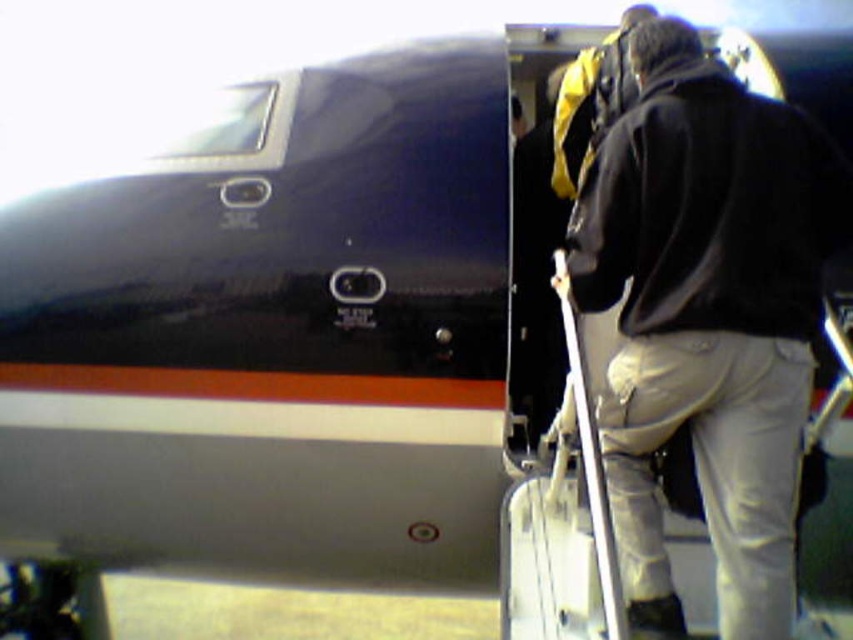
Does black leather jacket at center have a lesser height compared to white matte suitcase at center?

No, black leather jacket at center is not shorter than white matte suitcase at center.

Can you confirm if black leather jacket at center is positioned to the left of white matte suitcase at center?

In fact, black leather jacket at center is to the right of white matte suitcase at center.

Which is in front, point (659, 570) or point (587, 625)?

Positioned in front is point (659, 570).

Where is `black leather jacket at center`? This screenshot has height=640, width=853. black leather jacket at center is located at coordinates (706, 317).